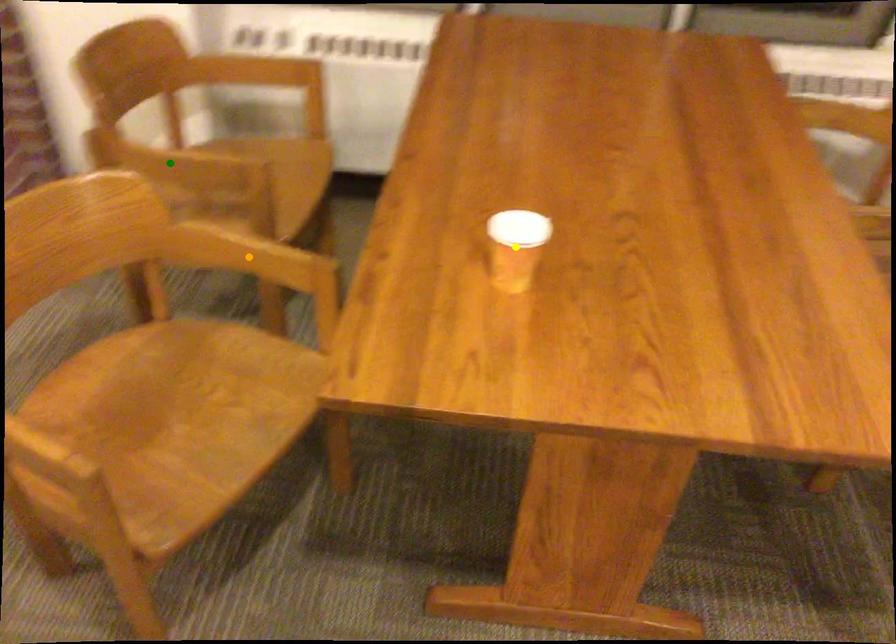
Order these from nearest to farthest:
A) yellow point
B) orange point
C) green point

1. green point
2. orange point
3. yellow point